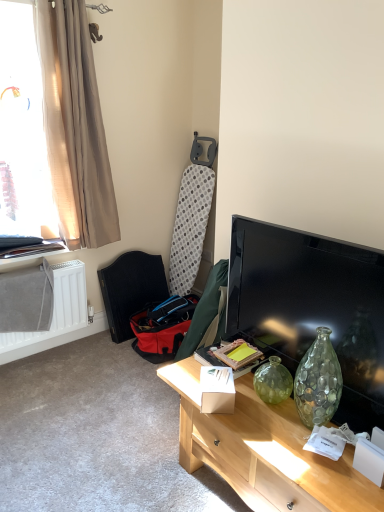
Find the location of a particular element. free space in front of white cardboard box at center is located at coordinates (249, 424).